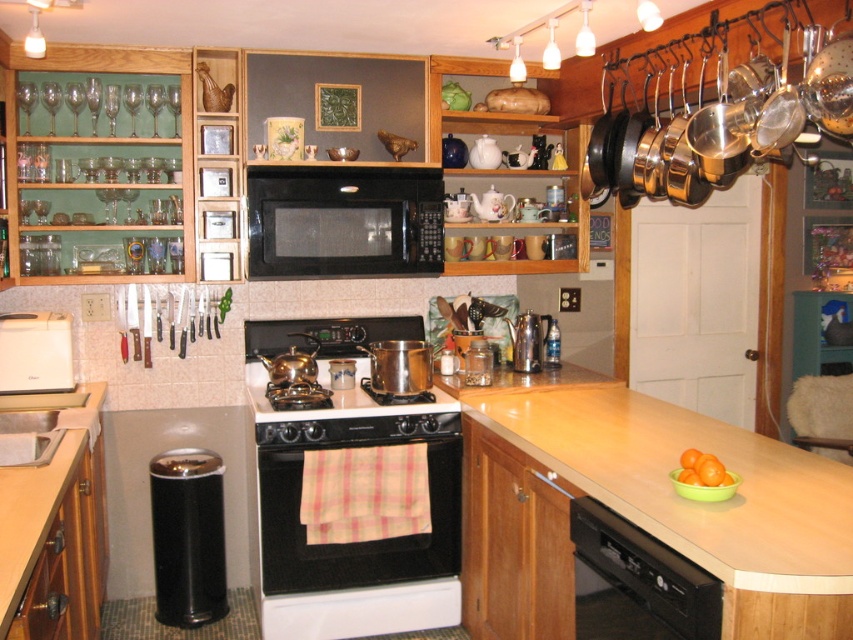
Question: Which point is farther to the camera?

Choices:
 (A) black matte microwave at center
 (B) wooden at lower left

Answer: (A)

Question: Observing the image, what is the correct spatial positioning of light brown laminate countertop at lower center in reference to wooden at lower left?

Choices:
 (A) left
 (B) right

Answer: (B)

Question: Which object is the farthest from the white plastic sink at lower left?

Choices:
 (A) metallic silver shaker at center
 (B) light brown laminate countertop at lower center
 (C) black plastic dishwasher at lower center

Answer: (A)

Question: Which of these objects is positioned farthest from the light brown laminate countertop at lower center?

Choices:
 (A) black matte microwave at center
 (B) metallic silver stove at center

Answer: (A)

Question: Considering the relative positions of black plastic dishwasher at lower center and metallic silver shaker at center in the image provided, where is black plastic dishwasher at lower center located with respect to metallic silver shaker at center?

Choices:
 (A) left
 (B) right

Answer: (B)

Question: Can you confirm if light brown laminate countertop at lower center is thinner than white glossy oven at center?

Choices:
 (A) no
 (B) yes

Answer: (A)